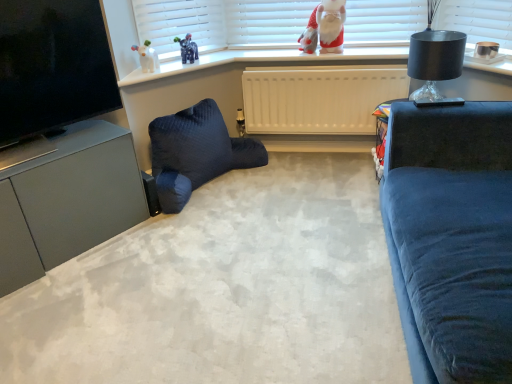
Image resolution: width=512 pixels, height=384 pixels. Identify the location of vacant space to the right of satin grey cabinet at lower left. (167, 249).